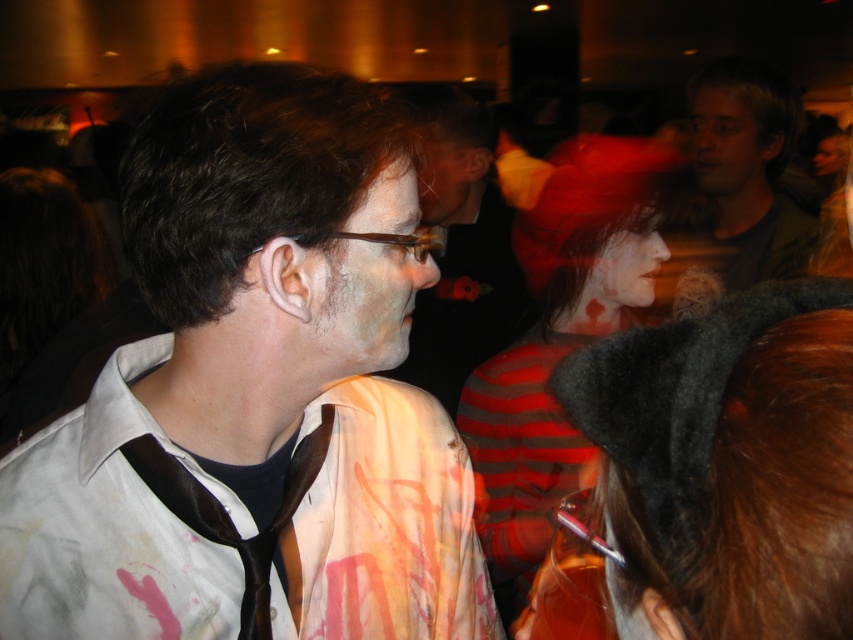
Question: From the image, what is the correct spatial relationship of striped wool sweater at center in relation to matte black shirt at center?

Choices:
 (A) right
 (B) left

Answer: (A)

Question: Among these objects, which one is nearest to the camera?

Choices:
 (A) blonde hair at upper right
 (B) dark gray felt cat ears at lower right
 (C) matte black shirt at center
 (D) transparent plastic glasses at center

Answer: (B)

Question: Which point appears closest to the camera in this image?

Choices:
 (A) (393, 237)
 (B) (540, 387)
 (C) (735, 76)
 (D) (169, 616)

Answer: (A)

Question: Does blonde hair at upper right appear over transparent plastic glasses at center?

Choices:
 (A) yes
 (B) no

Answer: (A)

Question: Does striped wool sweater at center have a larger size compared to transparent plastic glasses at center?

Choices:
 (A) yes
 (B) no

Answer: (A)

Question: Which point is closer to the camera?

Choices:
 (A) (758, 77)
 (B) (532, 228)
 (C) (218, 529)

Answer: (C)